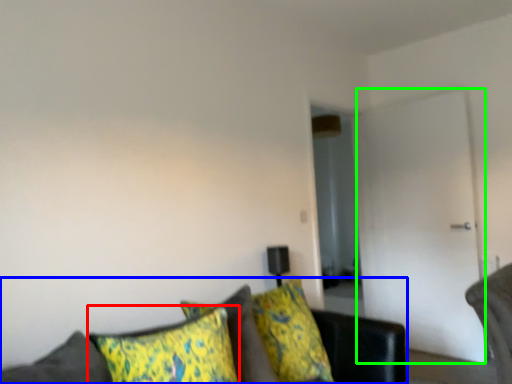
Question: Which is nearer to the pillow (highlighted by a red box)? studio couch (highlighted by a blue box) or glass door (highlighted by a green box).

Choices:
 (A) studio couch
 (B) glass door

Answer: (A)